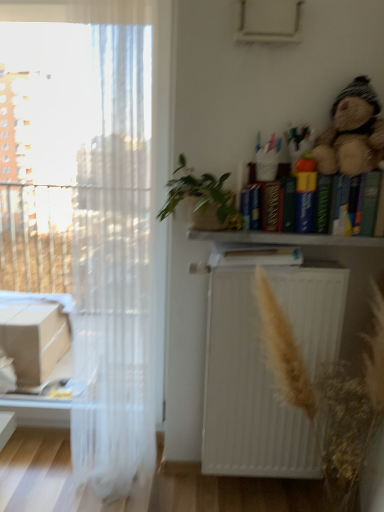
Measure the distance between point (313, 241) and camera.

1.51 meters.

The height and width of the screenshot is (512, 384). Find the location of `hardcover book at center, which is counted as the 2th book, starting from the right`. hardcover book at center, which is counted as the 2th book, starting from the right is located at coordinates (254, 255).

What do you see at coordinates (254, 255) in the screenshot? I see `hardcover book at center, the 1th book in the left-to-right sequence` at bounding box center [254, 255].

Image resolution: width=384 pixels, height=512 pixels. Describe the element at coordinates (328, 392) in the screenshot. I see `brown textured plant at center` at that location.

Locate an element on the screen. The width and height of the screenshot is (384, 512). wooden bookshelf at upper right is located at coordinates (284, 239).

Could wooden bookshelf at upper right be considered to be inside transparent fabric at left?

No, wooden bookshelf at upper right is not a part of transparent fabric at left.

Considering the sizes of objects transparent fabric at left and wooden bookshelf at upper right in the image provided, who is bigger, transparent fabric at left or wooden bookshelf at upper right?

transparent fabric at left.

Which is in front, point (102, 167) or point (300, 236)?

Positioned in front is point (300, 236).

In the image, there is a transparent fabric at left. At what (x,y) coordinates should I click in order to perform the action: click on shelf below it (from the image's perspective). Please return your answer as a coordinate pair (x, y). The image size is (384, 512). Looking at the image, I should click on (284, 239).

Does fuzzy brown teddy bear at upper right have a smaller size compared to green woven basket at upper center?

Correct, fuzzy brown teddy bear at upper right occupies less space than green woven basket at upper center.

Consider the image. Choose the correct answer: Is fuzzy brown teddy bear at upper right inside green woven basket at upper center or outside it?

fuzzy brown teddy bear at upper right is not enclosed by green woven basket at upper center.

The image size is (384, 512). Identify the location of houseplant that appears on the left of fuzzy brown teddy bear at upper right. (202, 196).

Can you confirm if fuzzy brown teddy bear at upper right is thinner than green woven basket at upper center?

Correct, the width of fuzzy brown teddy bear at upper right is less than that of green woven basket at upper center.

Is hardcover book at upper right, the 2th book from the left, taller or shorter than fuzzy brown teddy bear at upper right?

hardcover book at upper right, the 2th book from the left, is shorter than fuzzy brown teddy bear at upper right.

Is hardcover book at upper right, placed as the 1th book when sorted from top to bottom, with fuzzy brown teddy bear at upper right?

They are not placed beside each other.

Identify the location of toy on the left of hardcover book at upper right, placed as the 1th book when sorted from top to bottom. (352, 132).

From a real-world perspective, which is physically above, hardcover book at upper right, the 2th book from the left, or fuzzy brown teddy bear at upper right?

fuzzy brown teddy bear at upper right.

Which is in front, point (212, 258) or point (380, 311)?

Positioned in front is point (380, 311).

Which is more to the right, hardcover book at center, the 2th book viewed from the top, or brown textured plant at center?

Positioned to the right is brown textured plant at center.

Considering the sizes of objects hardcover book at center, the 1th book in the left-to-right sequence, and brown textured plant at center in the image provided, who is bigger, hardcover book at center, the 1th book in the left-to-right sequence, or brown textured plant at center?

brown textured plant at center.

Identify the location of plant directly beneath the hardcover book at center, which is counted as the 2th book, starting from the right (from a real-world perspective). (328, 392).

Is point (379, 187) positioned in front of point (95, 413)?

Yes, point (379, 187) is in front of point (95, 413).

How distant is hardcover book at upper right, which appears as the 2th book when ordered from the bottom, from transparent fabric at left?

A distance of 31.16 inches exists between hardcover book at upper right, which appears as the 2th book when ordered from the bottom, and transparent fabric at left.

Considering the sizes of objects hardcover book at upper right, the 2th book from the left, and transparent fabric at left in the image provided, who is thinner, hardcover book at upper right, the 2th book from the left, or transparent fabric at left?

With smaller width is transparent fabric at left.

Which object is positioned more to the right, hardcover book at upper right, placed as the 1th book when sorted from top to bottom, or transparent fabric at left?

From the viewer's perspective, hardcover book at upper right, placed as the 1th book when sorted from top to bottom, appears more on the right side.

Where is `book to the right of wooden bookshelf at upper right`? This screenshot has height=512, width=384. book to the right of wooden bookshelf at upper right is located at coordinates (364, 203).

Is point (329, 209) closer or farther from the camera than point (370, 243)?

Point (329, 209).

Looking at this image, can you confirm if hardcover book at upper right, the 2th book from the left, is positioned to the right of wooden bookshelf at upper right?

Indeed, hardcover book at upper right, the 2th book from the left, is positioned on the right side of wooden bookshelf at upper right.

From a real-world perspective, is hardcover book at upper right, placed as the 1th book when sorted from top to bottom, on wooden bookshelf at upper right?

Yes.

Considering the sizes of objects fuzzy brown teddy bear at upper right and transparent fabric at left in the image provided, who is wider, fuzzy brown teddy bear at upper right or transparent fabric at left?

fuzzy brown teddy bear at upper right is wider.

Are fuzzy brown teddy bear at upper right and transparent fabric at left making contact?

No, fuzzy brown teddy bear at upper right is not touching transparent fabric at left.

Is transparent fabric at left surrounded by fuzzy brown teddy bear at upper right?

No, transparent fabric at left is located outside of fuzzy brown teddy bear at upper right.

Is fuzzy brown teddy bear at upper right oriented away from transparent fabric at left?

fuzzy brown teddy bear at upper right is not turned away from transparent fabric at left.

Where is `window above the wooden bookshelf at upper right (from the image's perspective)`? window above the wooden bookshelf at upper right (from the image's perspective) is located at coordinates (91, 216).

Where is `houseplant behind the fuzzy brown teddy bear at upper right`? The height and width of the screenshot is (512, 384). houseplant behind the fuzzy brown teddy bear at upper right is located at coordinates (202, 196).

Consider the image. Based on their spatial positions, is brown textured plant at center or hardcover book at upper right, the 2th book from the left, closer to green woven basket at upper center?

The object closer to green woven basket at upper center is hardcover book at upper right, the 2th book from the left.

Which object lies nearer to the anchor point hardcover book at upper right, the 2th book from the left, fuzzy brown teddy bear at upper right or hardcover book at center, the 2th book viewed from the top?

fuzzy brown teddy bear at upper right is positioned closer to the anchor hardcover book at upper right, the 2th book from the left.

In the scene shown: Which object lies nearer to the anchor point fuzzy brown teddy bear at upper right, hardcover book at upper right, placed as the 1th book when sorted from top to bottom, or wooden bookshelf at upper right?

hardcover book at upper right, placed as the 1th book when sorted from top to bottom, lies closer to fuzzy brown teddy bear at upper right than the other object.

Looking at the image, which one is located closer to green woven basket at upper center, brown textured plant at center or white matte radiator at center?

white matte radiator at center is closer to green woven basket at upper center.

From the image, which object appears to be nearer to hardcover book at upper right, the 1th book viewed from the right, wooden bookshelf at upper right or transparent fabric at left?

The object closer to hardcover book at upper right, the 1th book viewed from the right, is wooden bookshelf at upper right.

From the image, which object appears to be farther from brown textured plant at center, green woven basket at upper center or hardcover book at upper right, which appears as the 2th book when ordered from the bottom?

green woven basket at upper center.

Looking at the image, which one is located closer to green woven basket at upper center, hardcover book at upper right, the 2th book from the left, or transparent fabric at left?

hardcover book at upper right, the 2th book from the left, is positioned closer to the anchor green woven basket at upper center.

From the image, which object appears to be nearer to fuzzy brown teddy bear at upper right, transparent fabric at left or white matte radiator at center?

white matte radiator at center is positioned closer to the anchor fuzzy brown teddy bear at upper right.

The height and width of the screenshot is (512, 384). I want to click on book between transparent fabric at left and white matte radiator at center from left to right, so click(x=254, y=255).

Where is `radiator between fuzzy brown teddy bear at upper right and brown textured plant at center in the up-down direction`? The height and width of the screenshot is (512, 384). radiator between fuzzy brown teddy bear at upper right and brown textured plant at center in the up-down direction is located at coordinates (247, 393).

This screenshot has height=512, width=384. I want to click on book between wooden bookshelf at upper right and brown textured plant at center in the vertical direction, so click(x=254, y=255).

Identify the location of shelf between green woven basket at upper center and white matte radiator at center in the vertical direction. The width and height of the screenshot is (384, 512). (284, 239).